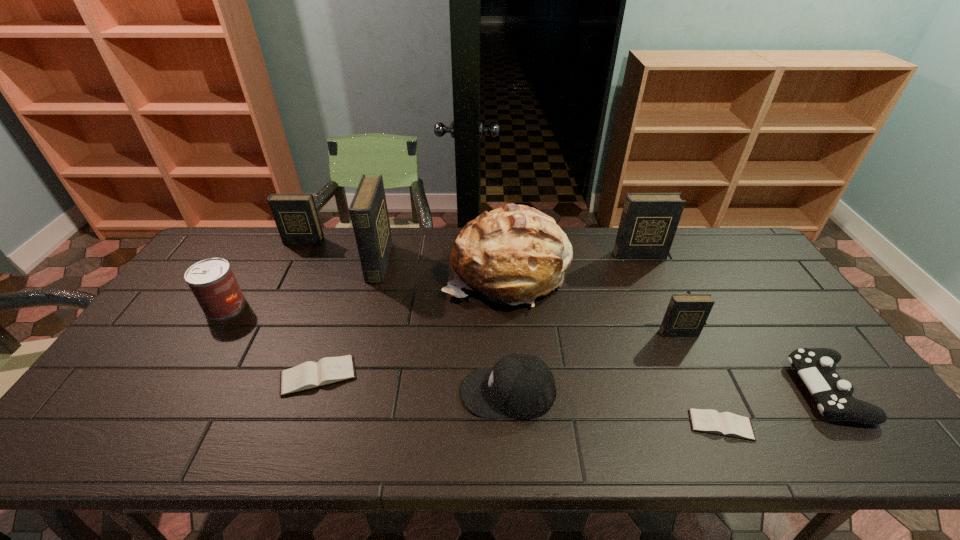
The image size is (960, 540). What are the coordinates of `bread located in the far edge section of the desktop` in the screenshot? It's located at (513, 254).

This screenshot has width=960, height=540. I want to click on cap at the near edge, so click(x=521, y=386).

Find the location of a particular element. control positioned at the near edge is located at coordinates (816, 366).

Find the location of a particular element. This screenshot has width=960, height=540. diary that is positioned at the near edge is located at coordinates (728, 424).

The height and width of the screenshot is (540, 960). I want to click on object located at the left edge, so click(212, 281).

At what (x,y) coordinates should I click in order to perform the action: click on object located at the right edge. Please return your answer as a coordinate pair (x, y). The width and height of the screenshot is (960, 540). Looking at the image, I should click on tap(816, 366).

The image size is (960, 540). Find the location of `object situated at the near right corner`. object situated at the near right corner is located at coordinates (816, 366).

What are the coordinates of `free region at the far edge of the desktop` in the screenshot? It's located at (340, 228).

The width and height of the screenshot is (960, 540). Identify the location of free space at the near edge of the desktop. 583,436.

In the image, there is a desktop. At what (x,y) coordinates should I click in order to perform the action: click on vacant region at the left edge. Please return your answer as a coordinate pair (x, y). The height and width of the screenshot is (540, 960). Looking at the image, I should click on (131, 380).